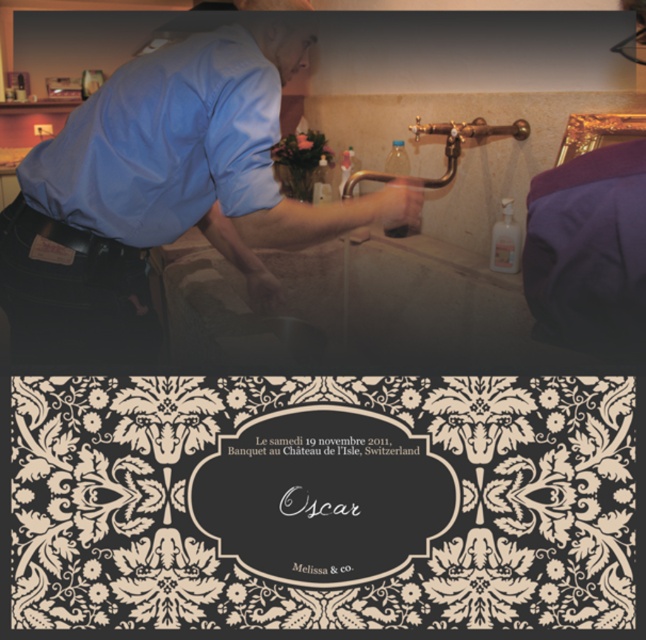
Question: Can you confirm if blue smooth shirt at center is positioned below matte blue shirt at upper left?

Choices:
 (A) no
 (B) yes

Answer: (B)

Question: Which point is closer to the camera taking this photo?

Choices:
 (A) (182, 115)
 (B) (262, 282)

Answer: (A)

Question: Is blue smooth shirt at center bigger than matte blue shirt at upper left?

Choices:
 (A) no
 (B) yes

Answer: (B)

Question: Does blue smooth shirt at center have a lesser width compared to matte blue shirt at upper left?

Choices:
 (A) no
 (B) yes

Answer: (A)